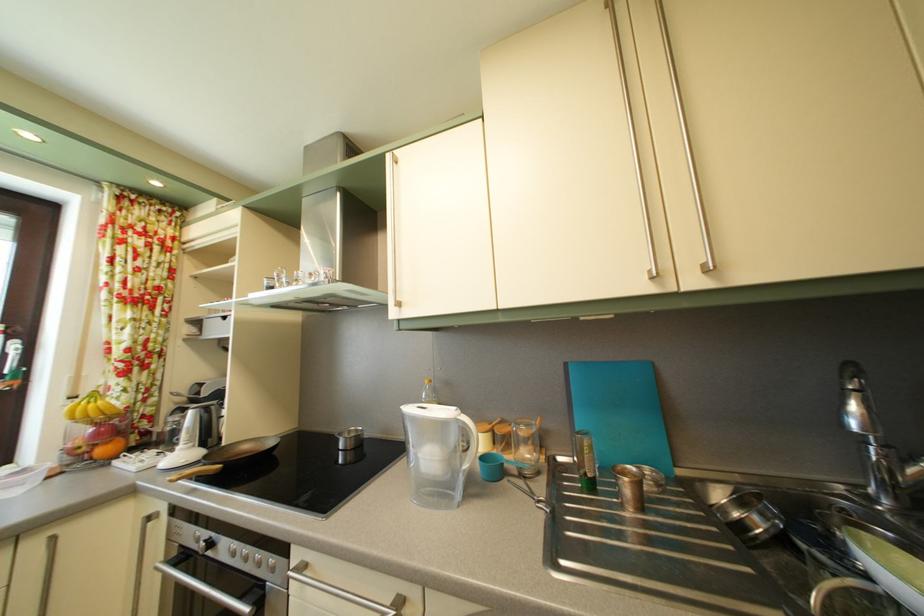
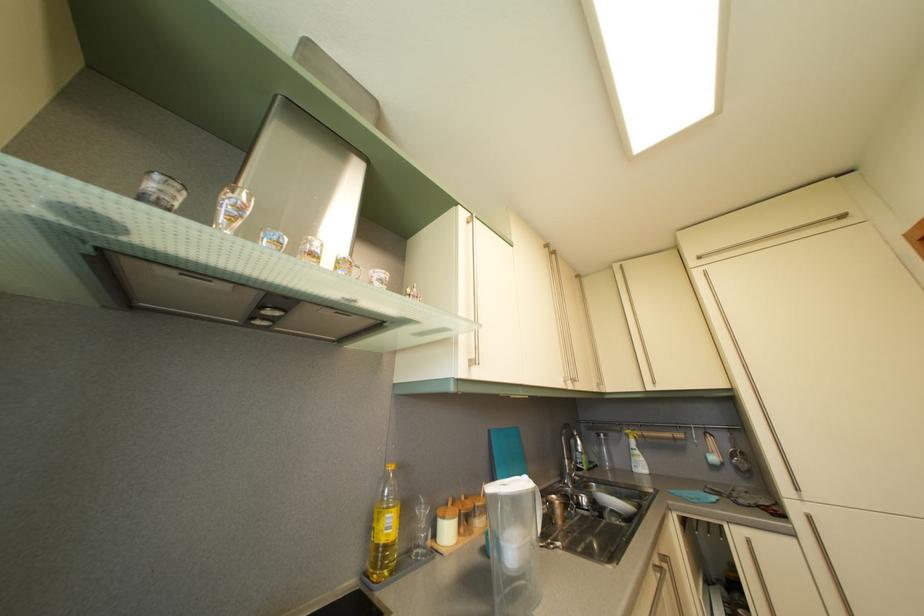
Where in the second image is the point corresponding to [859,371] from the first image?

(575, 432)